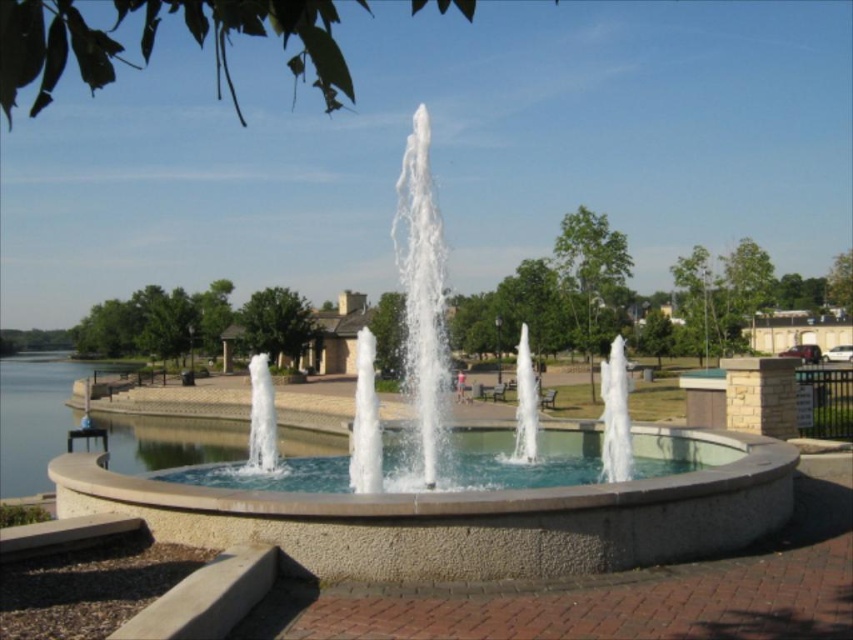
Between white stone fountain at center and clear glass water at center, which one appears on the right side from the viewer's perspective?

Positioned to the right is clear glass water at center.

Is point (439, 451) in front of point (444, 458)?

Yes, point (439, 451) is in front of point (444, 458).

Find the location of a particular element. This screenshot has height=640, width=853. white stone fountain at center is located at coordinates [463, 490].